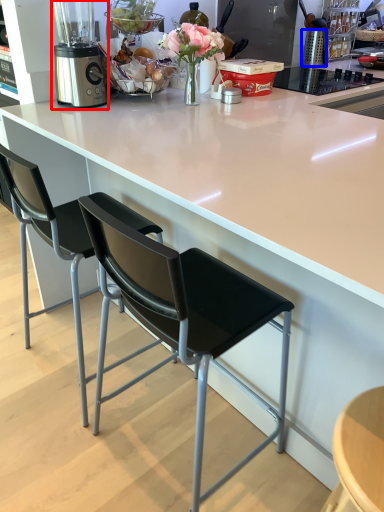
Question: Among these objects, which one is nearest to the camera, blender (highlighted by a red box) or kitchen appliance (highlighted by a blue box)?

Choices:
 (A) blender
 (B) kitchen appliance

Answer: (A)